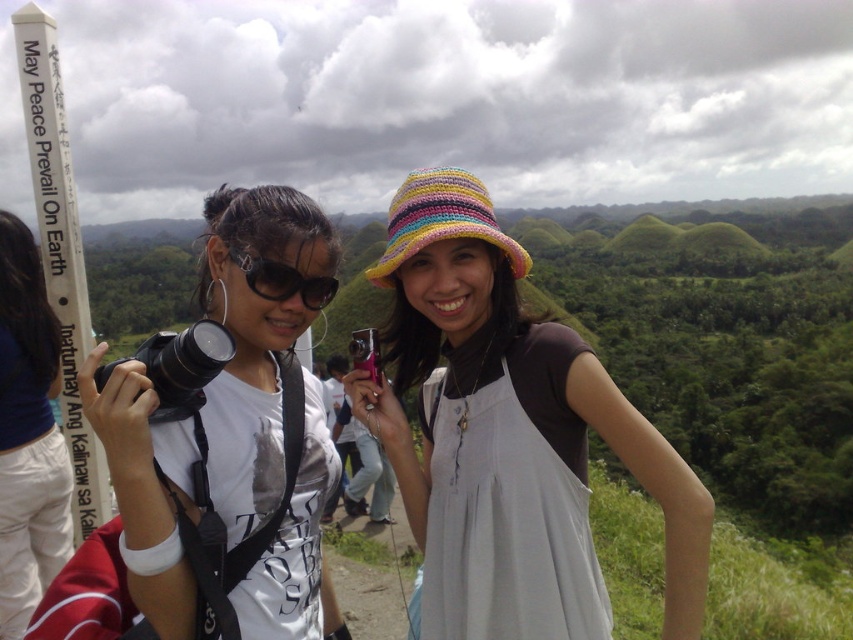
You are trying to take a photo of both the multicolored knitted hat at center and the black plastic camera at center. Which object should you focus on first to ensure it appears sharp in the photo?

The multicolored knitted hat at center is closer to the viewer than the black plastic camera at center, so you should focus on the multicolored knitted hat at center first to ensure it appears sharp in the photo.

You are trying to decide whether to place a new accessory on the matte black camera at left or the multicolored knitted hat at center. Based on their sizes, which object would allow the accessory to fit better?

The multicolored knitted hat at center occupies more space than the matte black camera at left, so the accessory would fit better on the multicolored knitted hat at center.